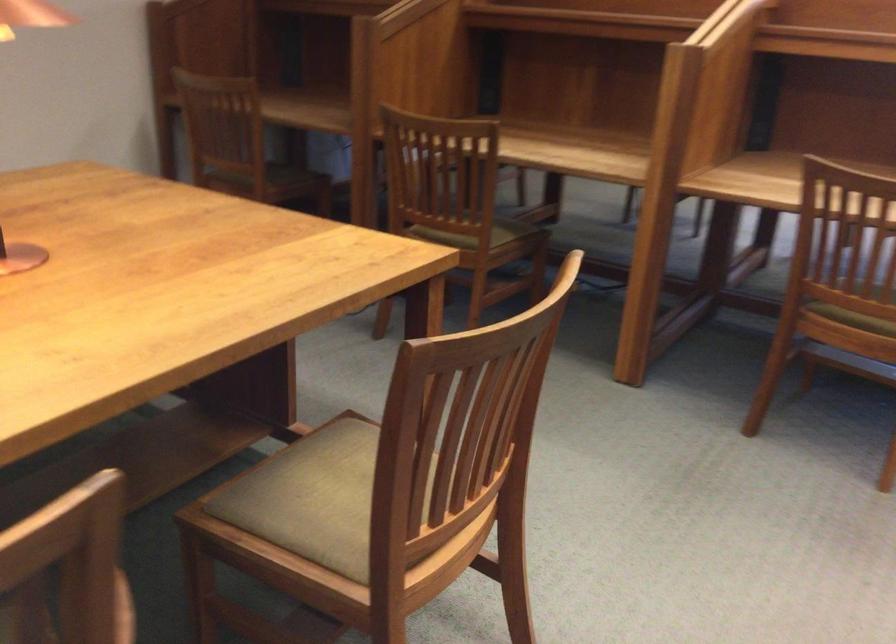
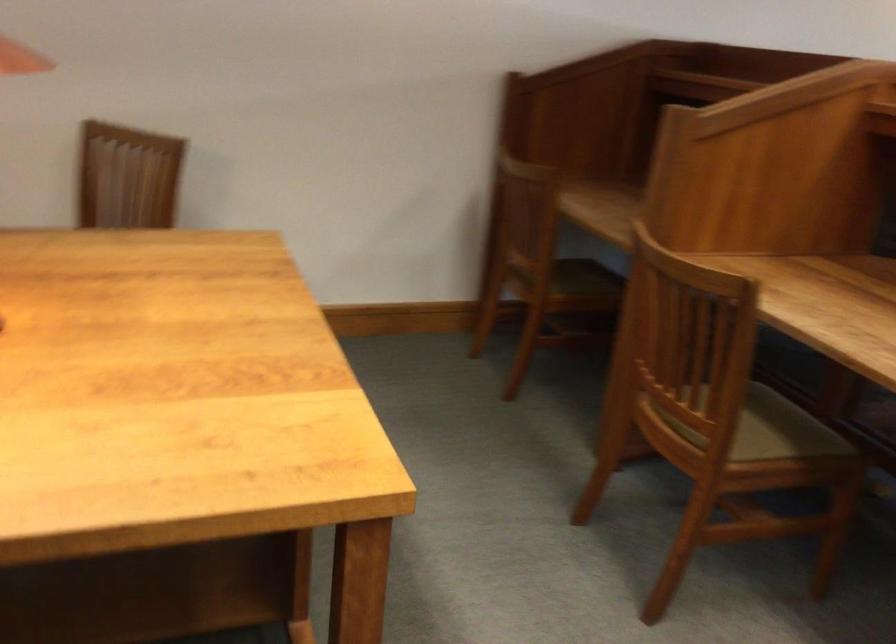
Locate, in the second image, the point that corresponds to (495,222) in the first image.

(765, 428)